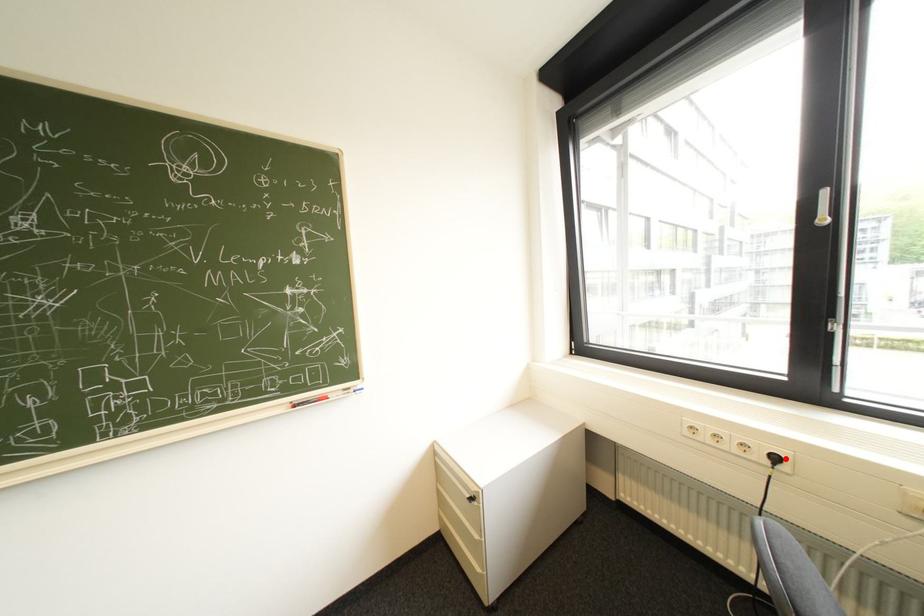
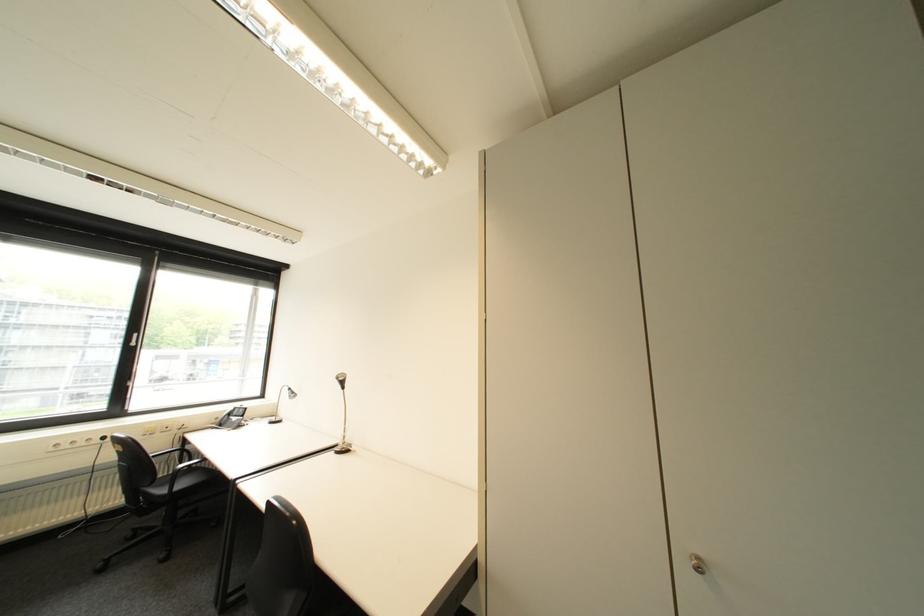
The point at the highlighted location is marked in the first image. Where is the corresponding point in the second image?

(114, 439)